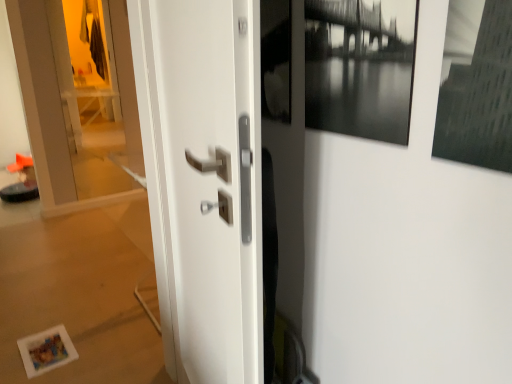
Question: Considering the positions of point (74, 3) and point (194, 145), is point (74, 3) closer or farther from the camera than point (194, 145)?

Choices:
 (A) closer
 (B) farther

Answer: (B)

Question: From the image's perspective, is transparent glass door at left positioned above or below white glossy door handle at center?

Choices:
 (A) above
 (B) below

Answer: (A)

Question: Which object is positioned closest to the transparent glass door at left?

Choices:
 (A) white glossy door handle at center
 (B) black matte picture frame at upper right

Answer: (A)

Question: Considering the real-world distances, which object is closest to the white glossy door handle at center?

Choices:
 (A) black matte picture frame at upper right
 (B) transparent glass door at left

Answer: (A)